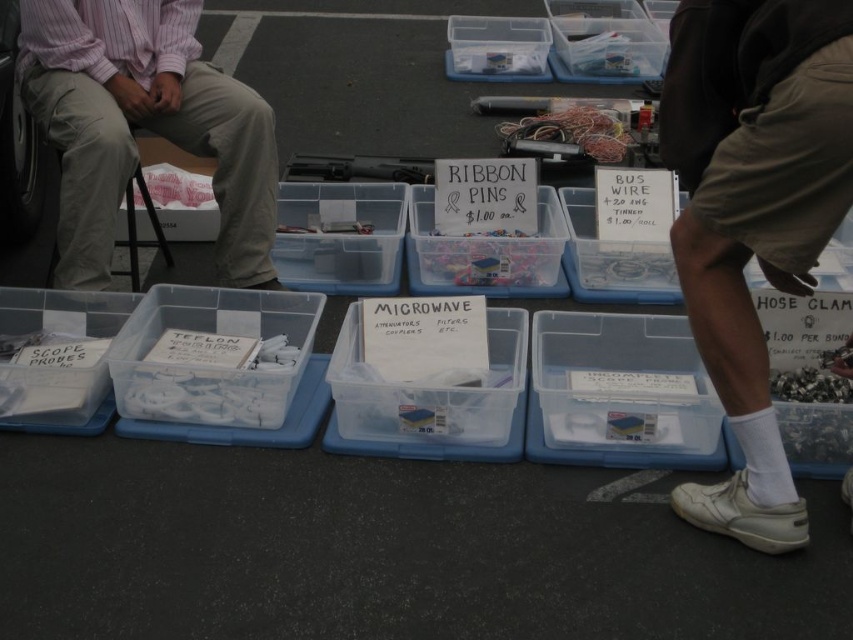
You are a vendor at the flea market and want to place a new item between the white plastic scope probes at left and the clear plastic container at center. The item is 12 inches long. Will there be enough space between them to fit the item?

The distance between the white plastic scope probes at left and the clear plastic container at center is 33.83 inches. Since the item is only 12 inches long, there is sufficient space to place it between them.

You are a customer at the flea market looking for a pair of white cotton socks. You see the white cotton socks at lower right and the translucent plastic container at center. Which item is placed higher?

The white cotton socks at lower right are positioned over the translucent plastic container at center, so they are placed higher.